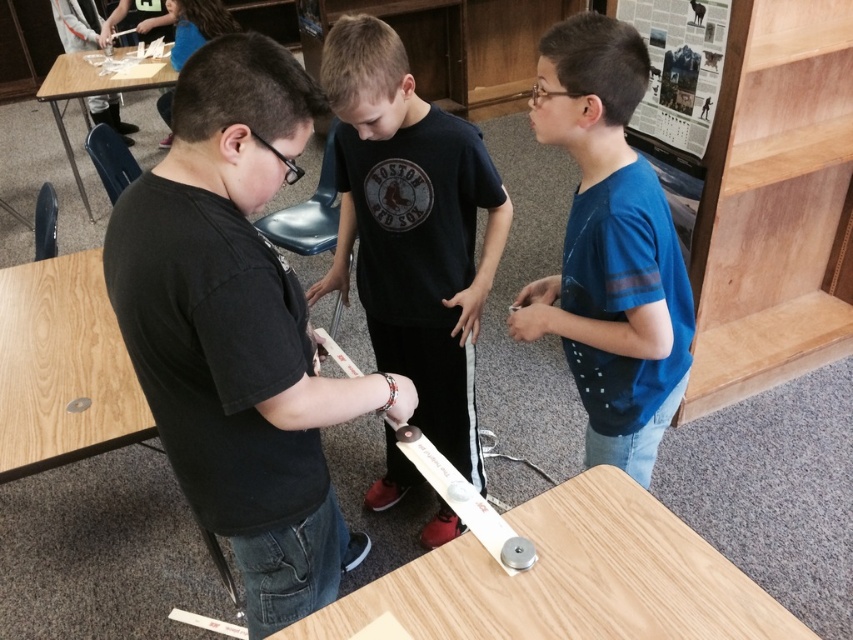
Question: Can you confirm if black matte shirt at center is positioned to the right of light brown wood table at lower left?

Choices:
 (A) no
 (B) yes

Answer: (B)

Question: Can you confirm if black matte shirt at center is bigger than light brown wood table at lower left?

Choices:
 (A) yes
 (B) no

Answer: (B)

Question: Does black matte shirt at center lie in front of wooden table at upper left?

Choices:
 (A) yes
 (B) no

Answer: (A)

Question: Which object is the closest to the light brown wood table at lower left?

Choices:
 (A) wooden table at upper left
 (B) light brown wood table at center
 (C) blue cotton shirt at center
 (D) black matte shirt at center

Answer: (D)

Question: Which point is farther to the camera?

Choices:
 (A) black cotton shirt at center
 (B) blue cotton shirt at center
 (C) wooden table at upper left

Answer: (C)

Question: Which object is the closest to the black matte shirt at center?

Choices:
 (A) blue cotton shirt at center
 (B) light brown wood table at lower left

Answer: (A)